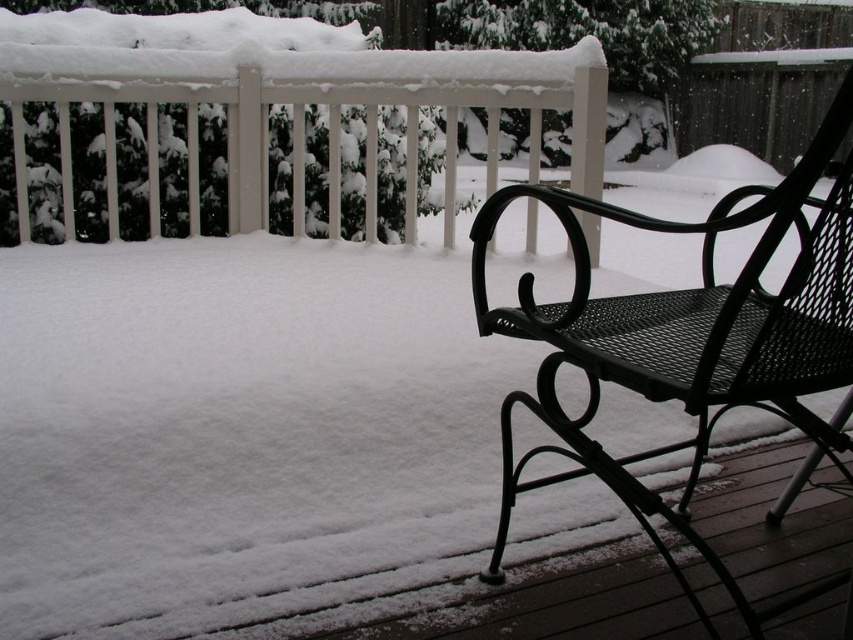
Which is behind, point (743, 301) or point (154, 81)?

Point (154, 81)

Looking at this image, between black mesh chair at right and white painted wood railing at upper left, which one is positioned lower?

black mesh chair at right

Does point (744, 364) come closer to viewer compared to point (436, 92)?

That is True.

Where is `black mesh chair at right`? The width and height of the screenshot is (853, 640). black mesh chair at right is located at coordinates (689, 340).